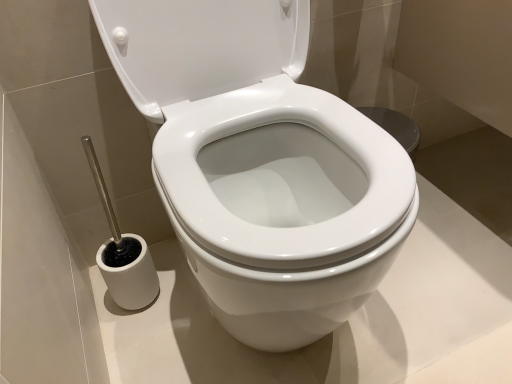
Where is `white ceramic toilet brush at left`? This screenshot has height=384, width=512. white ceramic toilet brush at left is located at coordinates (122, 252).

Image resolution: width=512 pixels, height=384 pixels. What do you see at coordinates (122, 252) in the screenshot?
I see `white ceramic toilet brush at left` at bounding box center [122, 252].

Measure the distance between point (118,266) and camera.

The depth of point (118,266) is 33.98 inches.

Identify the location of white ceramic toilet brush at left. (122, 252).